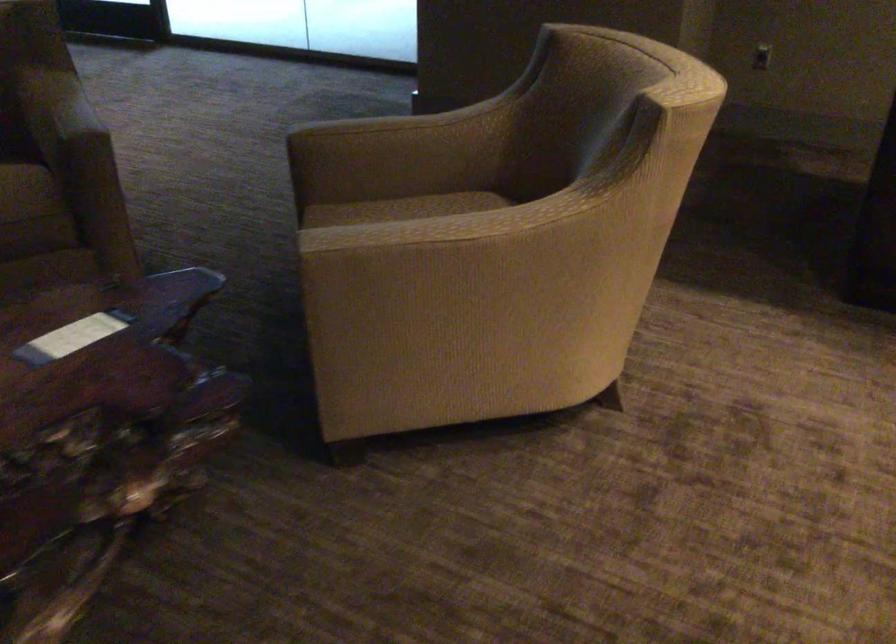
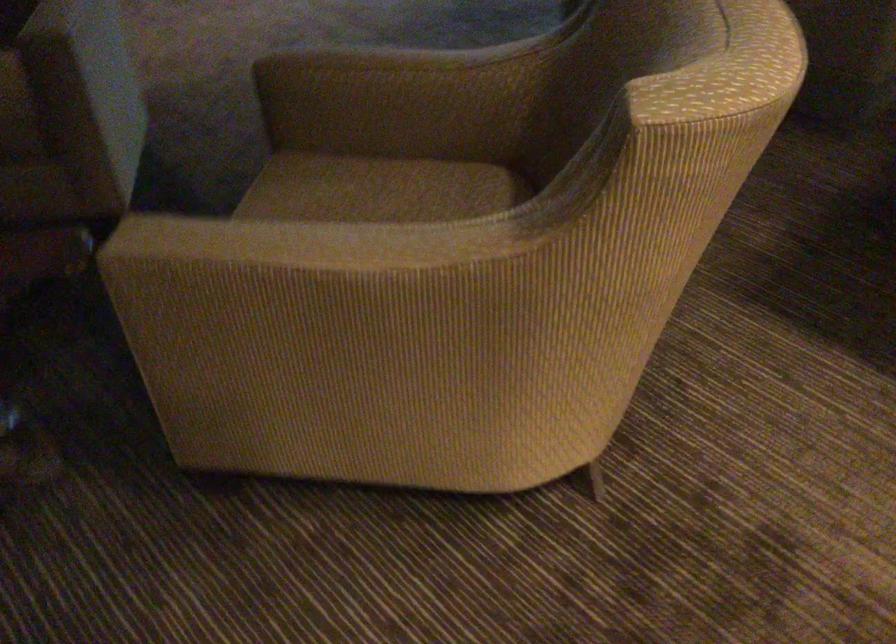
The point at (442, 227) is marked in the first image. Where is the corresponding point in the second image?

(298, 243)